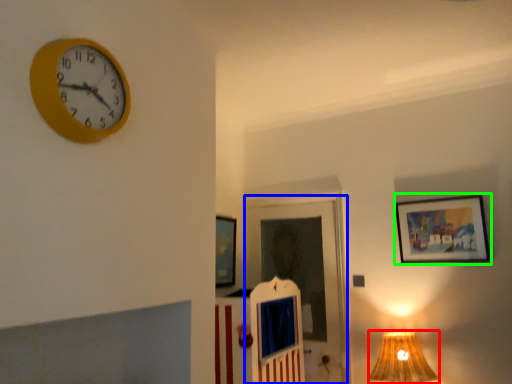
Question: Which object is positioned farthest from table lamp (highlighted by a red box)? Select from door (highlighted by a blue box) and picture frame (highlighted by a green box).

Choices:
 (A) door
 (B) picture frame

Answer: (A)